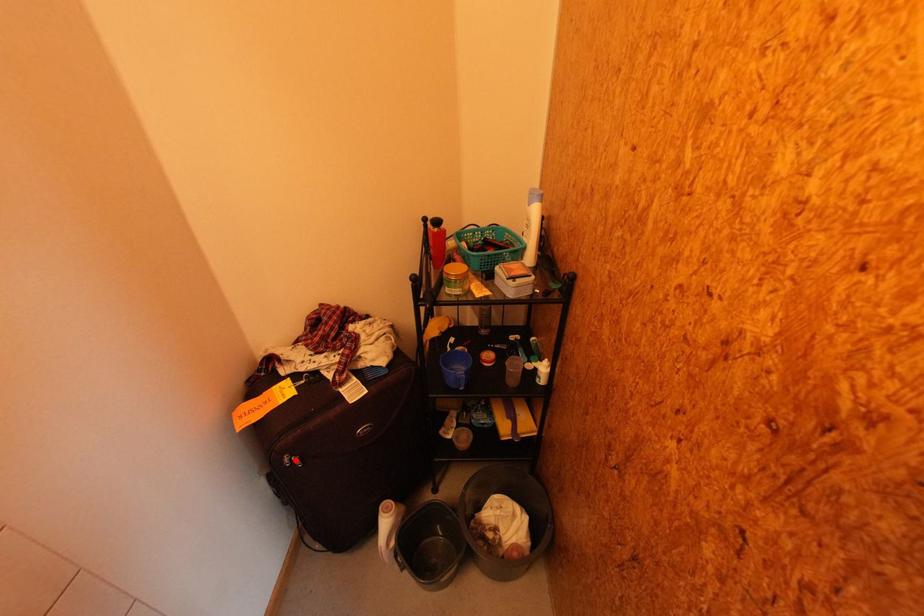
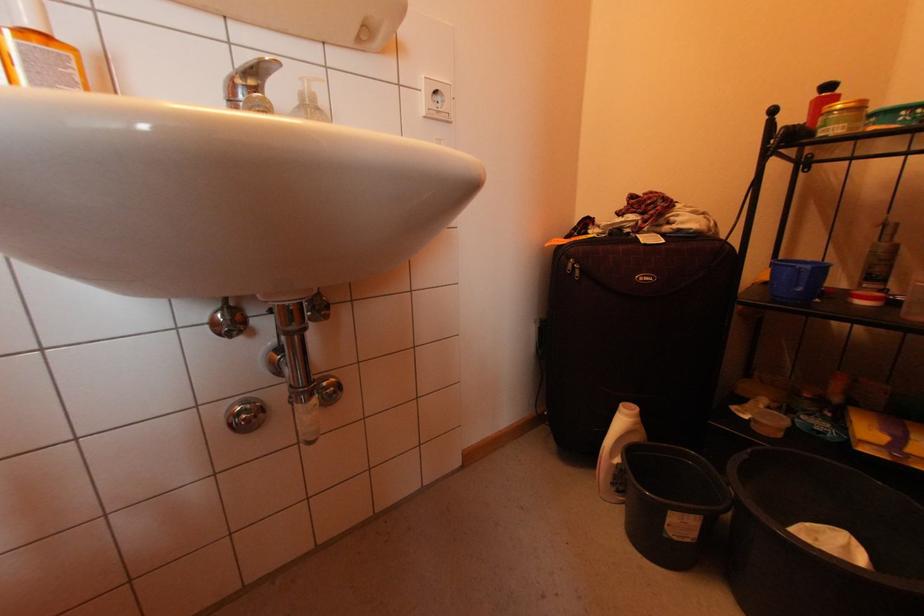
The point at the highlighted location is marked in the first image. Where is the corresponding point in the second image?

(578, 265)